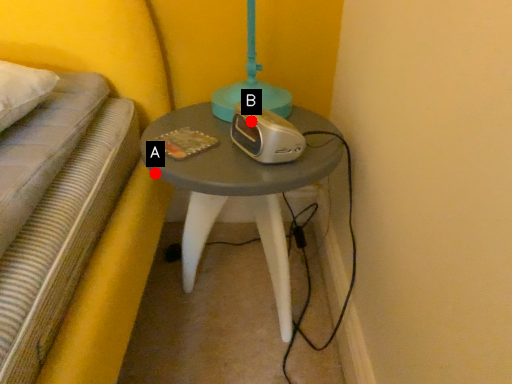
Question: Two points are circled on the image, labeled by A and B beside each circle. Which point is closer to the camera?

Choices:
 (A) A is closer
 (B) B is closer

Answer: (A)